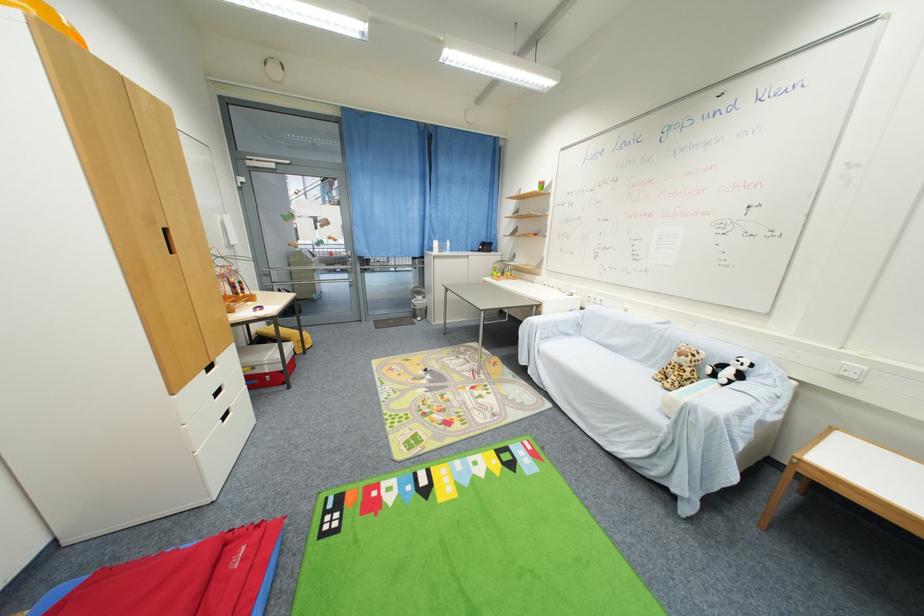
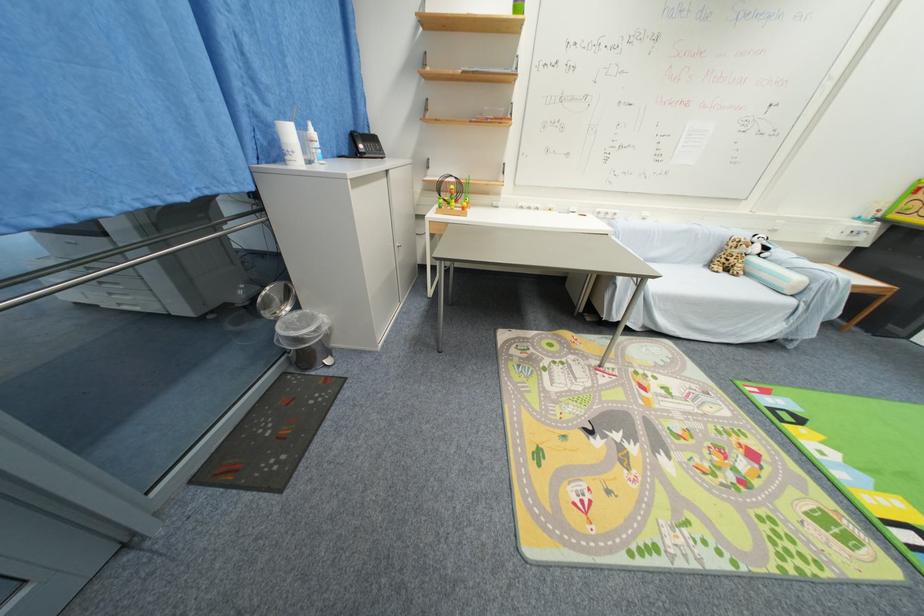
Where in the second image is the point corresponding to (x=429, y=300) from the first image?

(301, 309)